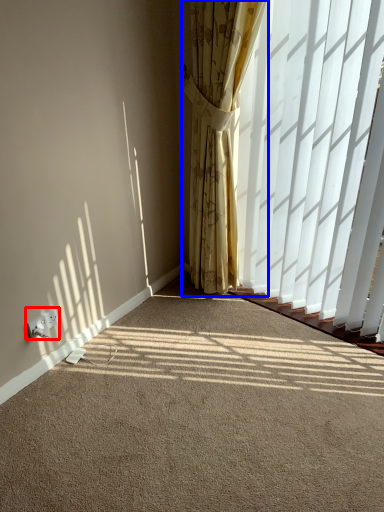
Question: Among these objects, which one is farthest to the camera, electric outlet (highlighted by a red box) or curtain (highlighted by a blue box)?

Choices:
 (A) electric outlet
 (B) curtain

Answer: (A)